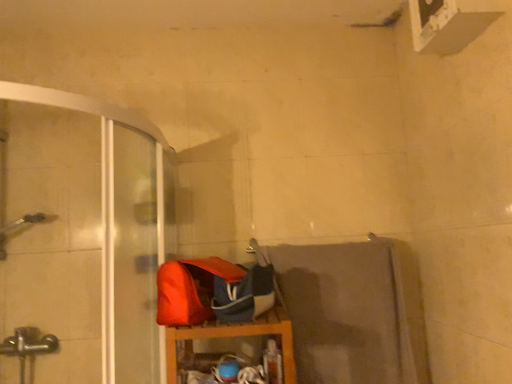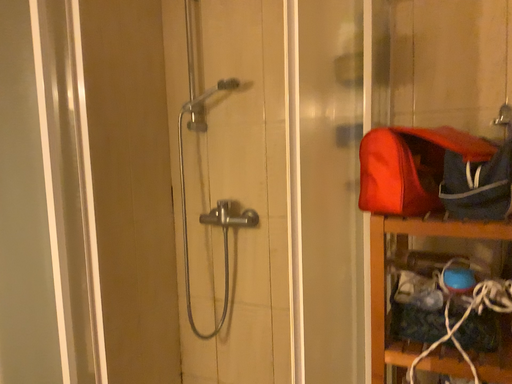
Question: Which way did the camera rotate in the video?

Choices:
 (A) rotated upward
 (B) rotated downward

Answer: (B)